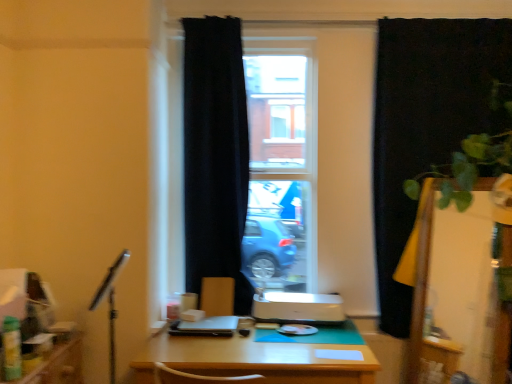
Question: Considering the relative sizes of black fabric curtain at center, which is counted as the 1th curtain, starting from the left, and wooden desk at center in the image provided, is black fabric curtain at center, which is counted as the 1th curtain, starting from the left, taller than wooden desk at center?

Choices:
 (A) no
 (B) yes

Answer: (B)

Question: Can you see black fabric curtain at center, which is counted as the 1th curtain, starting from the left, touching wooden desk at center?

Choices:
 (A) no
 (B) yes

Answer: (A)

Question: Does black fabric curtain at center, which is counted as the 1th curtain, starting from the left, contain wooden desk at center?

Choices:
 (A) no
 (B) yes

Answer: (A)

Question: Considering the relative sizes of black fabric curtain at center, which is the 2th curtain from right to left, and wooden desk at center in the image provided, is black fabric curtain at center, which is the 2th curtain from right to left, bigger than wooden desk at center?

Choices:
 (A) yes
 (B) no

Answer: (B)

Question: Is black fabric curtain at center, which is counted as the 1th curtain, starting from the left, not inside wooden desk at center?

Choices:
 (A) yes
 (B) no

Answer: (A)

Question: Is point (492, 273) positioned closer to the camera than point (178, 322)?

Choices:
 (A) closer
 (B) farther

Answer: (A)

Question: From the image's perspective, is transparent glass screen door at right above or below satin black laptop at center?

Choices:
 (A) below
 (B) above

Answer: (B)

Question: From their relative heights in the image, would you say transparent glass screen door at right is taller or shorter than satin black laptop at center?

Choices:
 (A) tall
 (B) short

Answer: (A)

Question: From a real-world perspective, relative to satin black laptop at center, is transparent glass screen door at right vertically above or below?

Choices:
 (A) above
 (B) below

Answer: (A)

Question: Visually, is white glossy printer at center positioned to the left or to the right of wooden desk at center?

Choices:
 (A) right
 (B) left

Answer: (A)

Question: Is white glossy printer at center situated inside wooden desk at center or outside?

Choices:
 (A) inside
 (B) outside

Answer: (B)

Question: From the image's perspective, relative to wooden desk at center, is white glossy printer at center above or below?

Choices:
 (A) above
 (B) below

Answer: (A)

Question: From a real-world perspective, is white glossy printer at center physically located above or below wooden desk at center?

Choices:
 (A) above
 (B) below

Answer: (A)

Question: From a real-world perspective, is matte brown armchair at center positioned above or below black fabric curtain at center, which is counted as the 1th curtain, starting from the left?

Choices:
 (A) above
 (B) below

Answer: (B)

Question: Considering the relative positions of matte brown armchair at center and black fabric curtain at center, which is counted as the 1th curtain, starting from the left, in the image provided, is matte brown armchair at center to the left or to the right of black fabric curtain at center, which is counted as the 1th curtain, starting from the left,?

Choices:
 (A) right
 (B) left

Answer: (B)